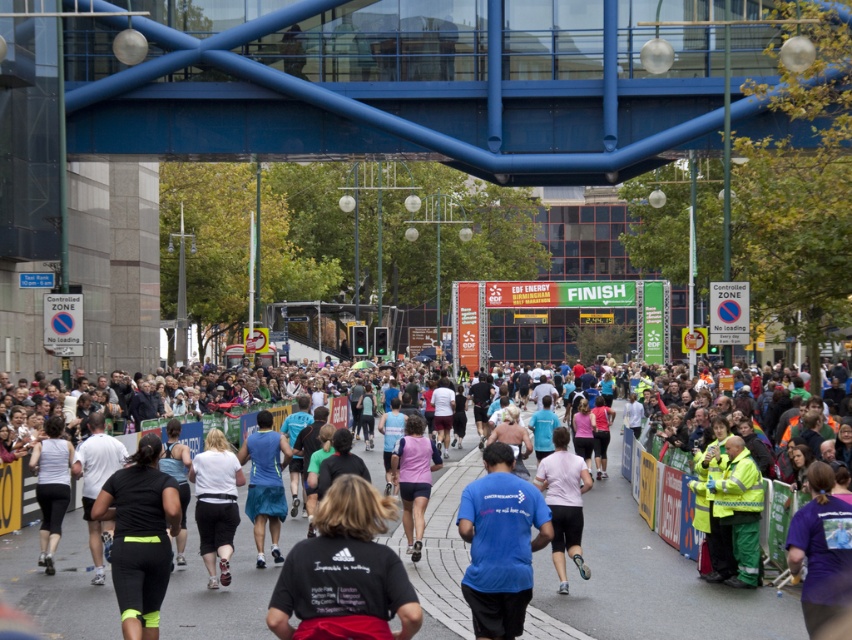
Who is more distant from viewer, [251,36] or [533,602]?

The point [251,36] is more distant.

Which of these two, blue metallic bridge at upper center or white cotton shirt at center, stands taller?

blue metallic bridge at upper center

Identify the location of blue metallic bridge at upper center. (401, 83).

What are the coordinates of `blue metallic bridge at upper center` in the screenshot? It's located at (401, 83).